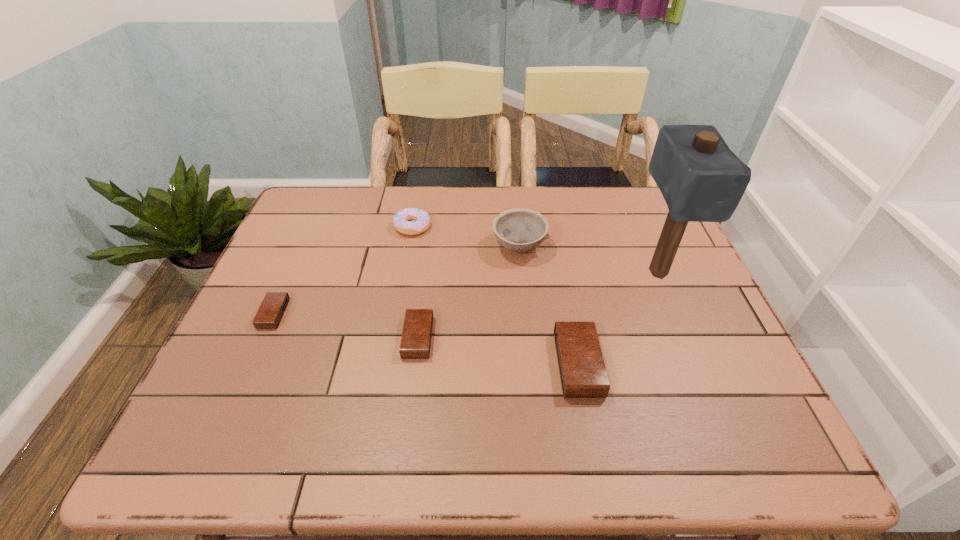
Please point a vacant point for placing a alarm clock on the right. Please provide its 2D coordinates. Your answer should be formatted as a tuple, i.e. [(x, y)], where the tuple contains the x and y coordinates of a point satisfying the conditions above.

[(756, 393)]